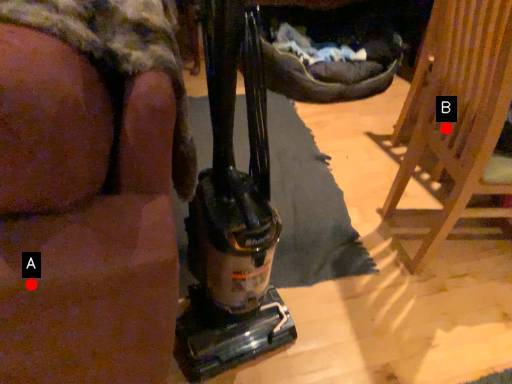
Question: Two points are circled on the image, labeled by A and B beside each circle. Which point is closer to the camera?

Choices:
 (A) A is closer
 (B) B is closer

Answer: (A)